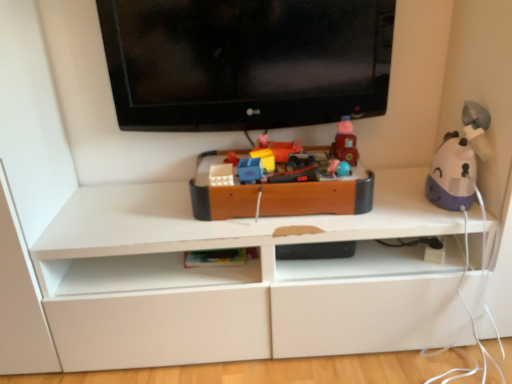
Question: Is matte plastic toy at center, which is the 6th toy in right-to-left order, to the right of matte plastic toy car at center, the 3th toy positioned from the left, from the viewer's perspective?

Choices:
 (A) no
 (B) yes

Answer: (A)

Question: Is matte plastic toy car at center, arranged as the 4th toy when viewed from the right, a part of matte plastic toy at center, which is counted as the 1th toy, starting from the left?

Choices:
 (A) no
 (B) yes

Answer: (A)

Question: Does matte plastic toy at center, which is the 6th toy in right-to-left order, have a greater height compared to matte plastic toy car at center, arranged as the 4th toy when viewed from the right?

Choices:
 (A) yes
 (B) no

Answer: (B)

Question: Is matte plastic toy at center, which is the 6th toy in right-to-left order, behind matte plastic toy car at center, the 3th toy positioned from the left?

Choices:
 (A) yes
 (B) no

Answer: (A)

Question: Is matte plastic toy at center, which is the 6th toy in right-to-left order, not close to matte plastic toy car at center, the 3th toy positioned from the left?

Choices:
 (A) no
 (B) yes

Answer: (A)

Question: From the image's perspective, does matte plastic toy at center, which is counted as the 1th toy, starting from the left, appear lower than matte plastic toy car at center, arranged as the 4th toy when viewed from the right?

Choices:
 (A) yes
 (B) no

Answer: (B)

Question: Can you confirm if matte plastic toy at center, the second toy positioned from the right, is shorter than matte plastic toy car at center, arranged as the 4th toy when viewed from the right?

Choices:
 (A) no
 (B) yes

Answer: (A)

Question: Is matte plastic toy car at center, the 3th toy positioned from the left, inside matte plastic toy at center, the second toy positioned from the right?

Choices:
 (A) yes
 (B) no

Answer: (B)

Question: Are matte plastic toy at center, the second toy positioned from the right, and matte plastic toy car at center, arranged as the 4th toy when viewed from the right, located far from each other?

Choices:
 (A) yes
 (B) no

Answer: (B)

Question: Considering the relative sizes of matte plastic toy at center, acting as the 5th toy starting from the left, and matte plastic toy car at center, the 3th toy positioned from the left, in the image provided, is matte plastic toy at center, acting as the 5th toy starting from the left, thinner than matte plastic toy car at center, the 3th toy positioned from the left,?

Choices:
 (A) no
 (B) yes

Answer: (A)

Question: Does matte plastic toy at center, acting as the 5th toy starting from the left, lie behind matte plastic toy car at center, arranged as the 4th toy when viewed from the right?

Choices:
 (A) no
 (B) yes

Answer: (A)

Question: Does matte plastic toy at center, the second toy positioned from the right, have a larger size compared to matte plastic toy car at center, arranged as the 4th toy when viewed from the right?

Choices:
 (A) yes
 (B) no

Answer: (A)

Question: Is matte plastic toy at center, the second toy positioned from the right, not near purple matte humidifier at right, the 6th toy from the left?

Choices:
 (A) yes
 (B) no

Answer: (B)